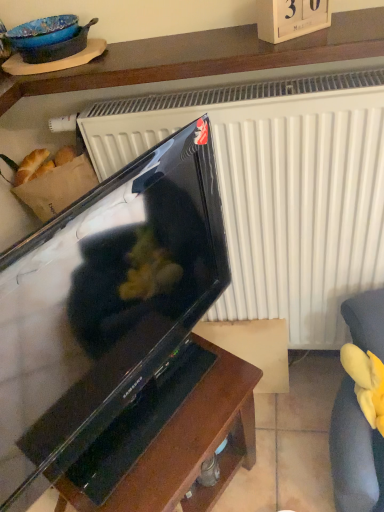
Identify the location of free space above wooden shelf at upper center (from a real-world perspective). (192, 42).